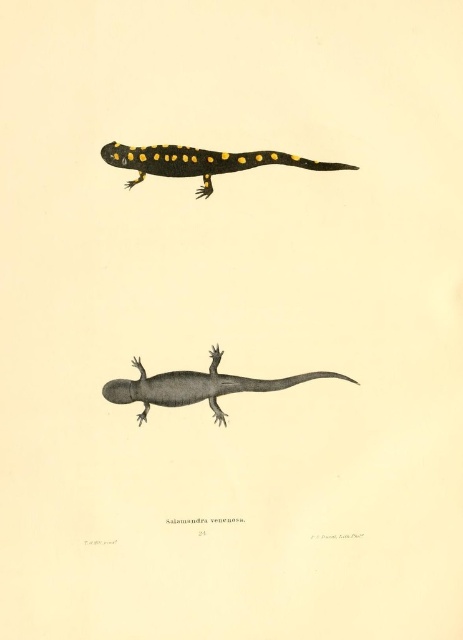
Question: Does gray matte salamander at center come in front of black glossy salamander at upper center?

Choices:
 (A) yes
 (B) no

Answer: (B)

Question: Which object is farther from the camera taking this photo?

Choices:
 (A) black glossy salamander at upper center
 (B) gray matte salamander at center

Answer: (B)

Question: Which point is farther to the camera?

Choices:
 (A) (127, 401)
 (B) (204, 161)

Answer: (A)

Question: Considering the relative positions of gray matte salamander at center and black glossy salamander at upper center in the image provided, where is gray matte salamander at center located with respect to black glossy salamander at upper center?

Choices:
 (A) left
 (B) right

Answer: (B)

Question: Is gray matte salamander at center to the right of black glossy salamander at upper center from the viewer's perspective?

Choices:
 (A) no
 (B) yes

Answer: (B)